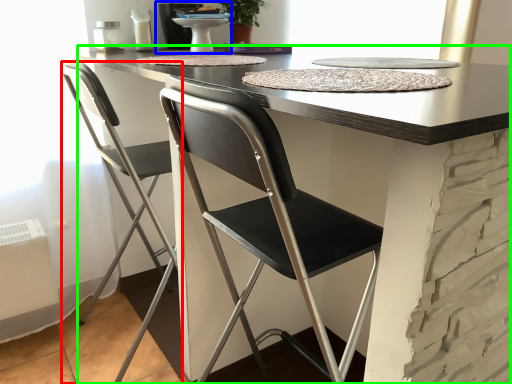
Question: Which object is positioned closest to chair (highlighted by a red box)? Select from sink (highlighted by a blue box) and table (highlighted by a green box).

Choices:
 (A) sink
 (B) table

Answer: (A)